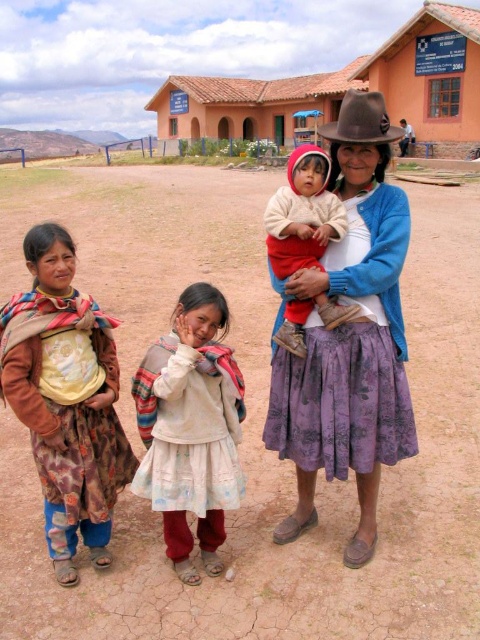
You are an architect designing a new building. You need to ensure that the new building does not block the view of the terracotta clay building at center from the brown felt hat at upper center. Given their height difference, what should you consider?

The terracotta clay building at center is taller than the brown felt hat at upper center. To avoid blocking the view, the new building should be shorter than the terracotta clay building at center so that the hat remains visible from its position.

You are standing at the origin point in this rural scene. There are two points marked in the image. Which point is closer to you, point (428, 147) or point (319, 180)?

Point (319, 180) is closer to you because it is in front of point (428, 147).